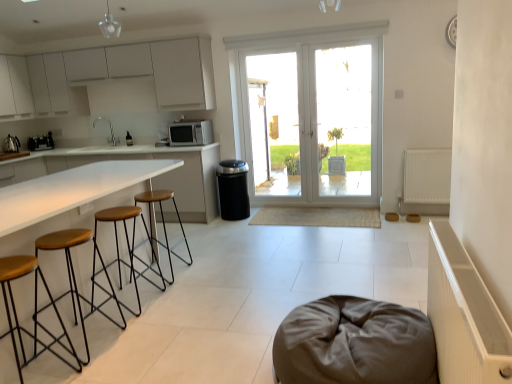
Find the location of a particular element. The image size is (512, 384). free location to the right of brown wood/black metal stool at left, acting as the 3th stool starting from the back is located at coordinates click(x=137, y=344).